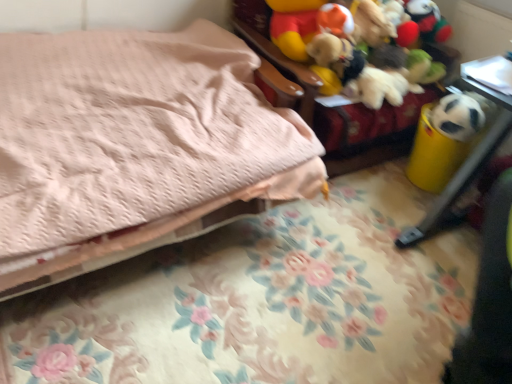
Question: Does pink quilted bed at upper left have a smaller size compared to soft fabric stuffed toys at upper right, the 2th furniture in the bottom-to-top sequence?

Choices:
 (A) yes
 (B) no

Answer: (B)

Question: Is pink quilted bed at upper left thinner than soft fabric stuffed toys at upper right, which ranks as the 1th furniture in top-to-bottom order?

Choices:
 (A) yes
 (B) no

Answer: (B)

Question: Considering the relative positions of pink quilted bed at upper left and soft fabric stuffed toys at upper right, which ranks as the 1th furniture in top-to-bottom order, in the image provided, is pink quilted bed at upper left to the right of soft fabric stuffed toys at upper right, which ranks as the 1th furniture in top-to-bottom order, from the viewer's perspective?

Choices:
 (A) yes
 (B) no

Answer: (B)

Question: Are pink quilted bed at upper left and soft fabric stuffed toys at upper right, the 2th furniture in the bottom-to-top sequence, located far from each other?

Choices:
 (A) yes
 (B) no

Answer: (B)

Question: Is pink quilted bed at upper left positioned beyond the bounds of soft fabric stuffed toys at upper right, which ranks as the 1th furniture in top-to-bottom order?

Choices:
 (A) no
 (B) yes

Answer: (B)

Question: Does pink quilted bed at upper left lie in front of soft fabric stuffed toys at upper right, the 2th furniture in the bottom-to-top sequence?

Choices:
 (A) yes
 (B) no

Answer: (A)

Question: Could you tell me if yellow plastic trash can at right, positioned as the 2th furniture in top-to-bottom order, is turned towards white matte panda at right?

Choices:
 (A) yes
 (B) no

Answer: (B)

Question: Are yellow plastic trash can at right, positioned as the 2th furniture in top-to-bottom order, and white matte panda at right located far from each other?

Choices:
 (A) yes
 (B) no

Answer: (B)

Question: Can you confirm if yellow plastic trash can at right, the 1th furniture from the bottom, is positioned to the right of white matte panda at right?

Choices:
 (A) no
 (B) yes

Answer: (B)

Question: Considering the relative sizes of yellow plastic trash can at right, the 1th furniture from the bottom, and white matte panda at right in the image provided, is yellow plastic trash can at right, the 1th furniture from the bottom, bigger than white matte panda at right?

Choices:
 (A) yes
 (B) no

Answer: (A)

Question: Does yellow plastic trash can at right, positioned as the 2th furniture in top-to-bottom order, come in front of white matte panda at right?

Choices:
 (A) no
 (B) yes

Answer: (B)

Question: Is the depth of yellow plastic trash can at right, the 1th furniture from the bottom, greater than that of white matte panda at right?

Choices:
 (A) no
 (B) yes

Answer: (A)

Question: Is white matte panda at right completely or partially inside soft fabric stuffed toys at upper right, the 2th furniture in the bottom-to-top sequence?

Choices:
 (A) yes
 (B) no

Answer: (B)